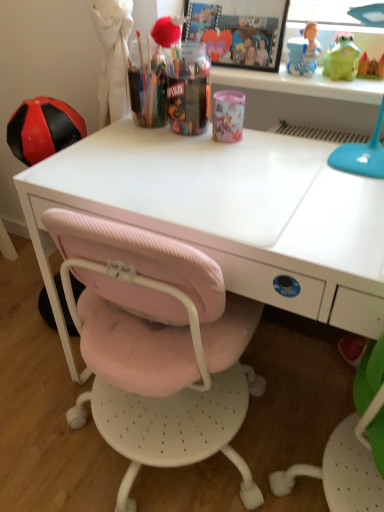
I want to click on vacant area that is in front of pink glossy cup at center, which ranks as the 2th stationery in left-to-right order, so click(231, 164).